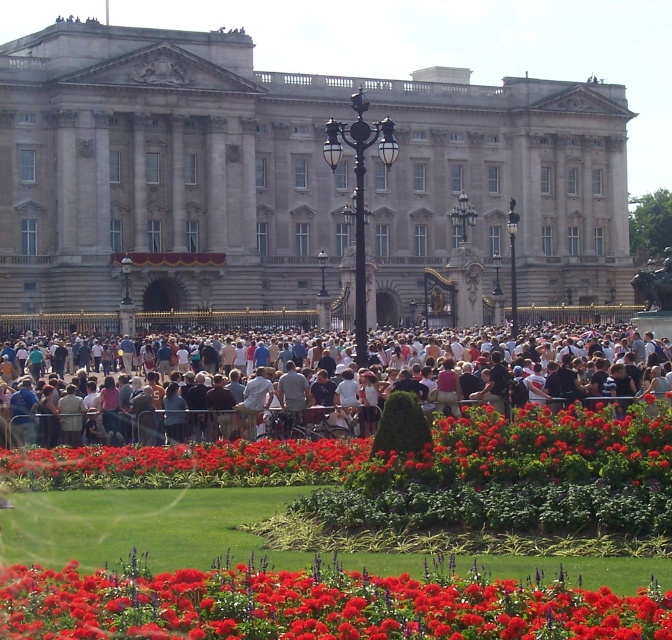
Question: Can you confirm if bright red petals at center is wider than vivid red petals at center?

Choices:
 (A) yes
 (B) no

Answer: (B)

Question: Does bright red petals at center have a smaller size compared to vivid red petals at center?

Choices:
 (A) no
 (B) yes

Answer: (B)

Question: Which object is positioned farthest from the bright red petals at center?

Choices:
 (A) light brown wooden bench at center
 (B) vivid red petals at center
 (C) stone facade palace at center

Answer: (C)

Question: Which of these objects is positioned closest to the light brown wooden bench at center?

Choices:
 (A) stone facade palace at center
 (B) vivid red petals at center
 (C) bright red petals at center

Answer: (B)

Question: Considering the relative positions of stone facade palace at center and bright red petals at center in the image provided, where is stone facade palace at center located with respect to bright red petals at center?

Choices:
 (A) above
 (B) below

Answer: (A)

Question: Which of the following is the closest to the observer?

Choices:
 (A) (75, 129)
 (B) (462, 346)

Answer: (B)